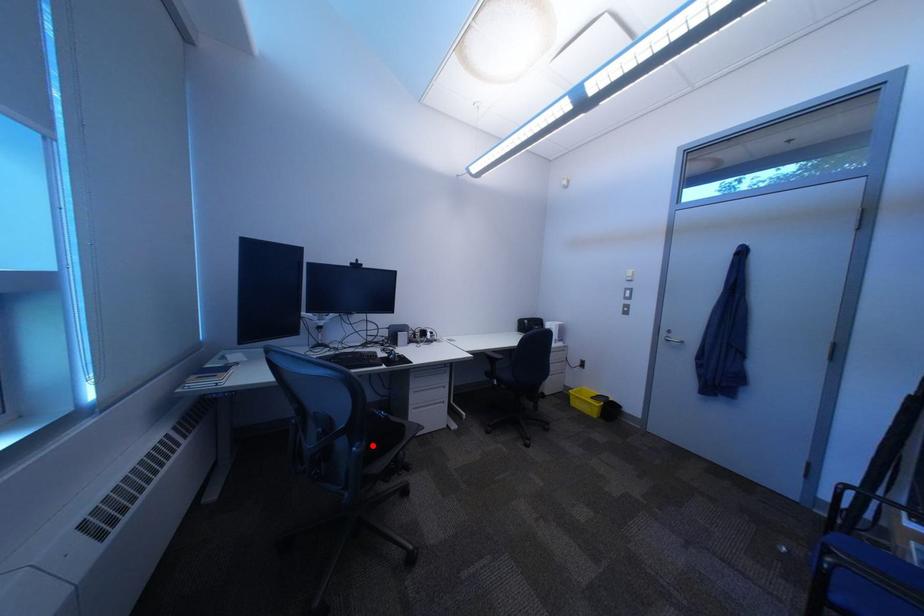
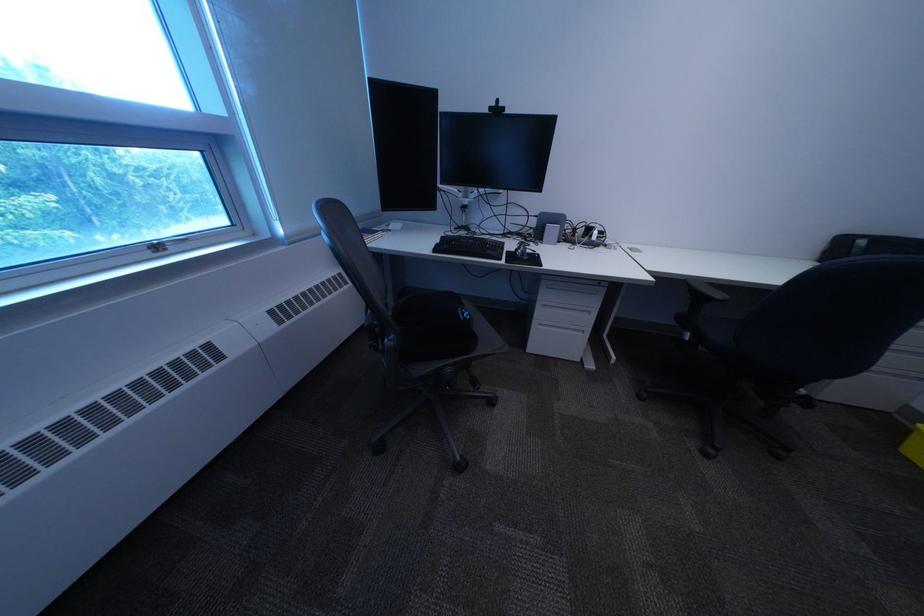
Where in the second image is the point corresponding to the highlighted location from the first image?

(407, 338)